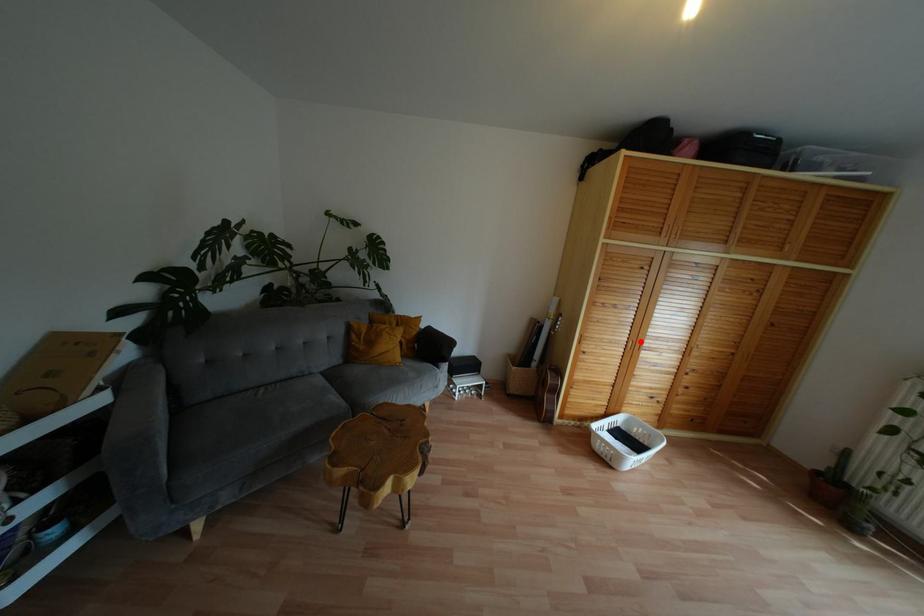
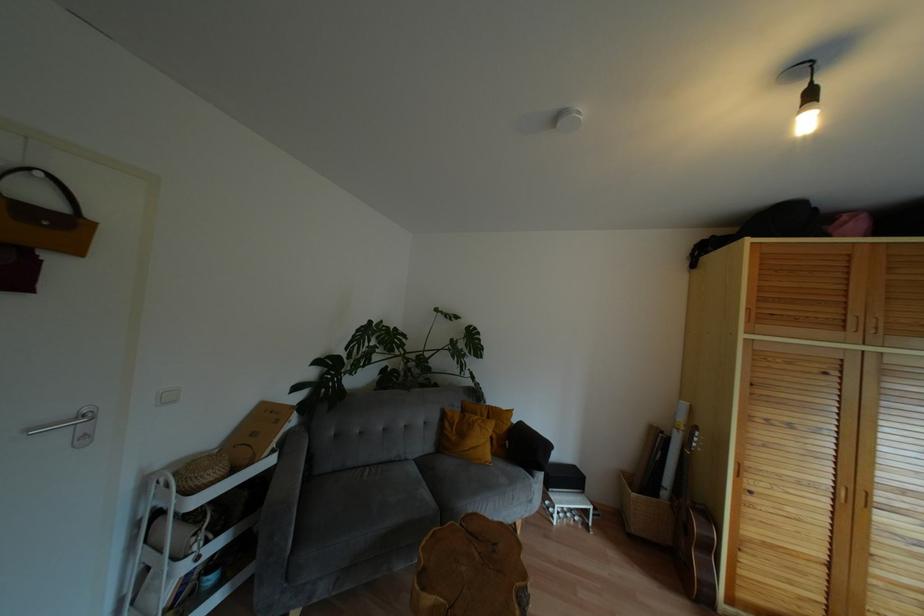
Question: I am providing you with two images of the same scene from different viewpoints. Image1 has a red point marked. In image2, the corresponding 3D location appears at what relative position? Reply with the corresponding letter.

Choices:
 (A) Closer
 (B) Farther

Answer: (A)